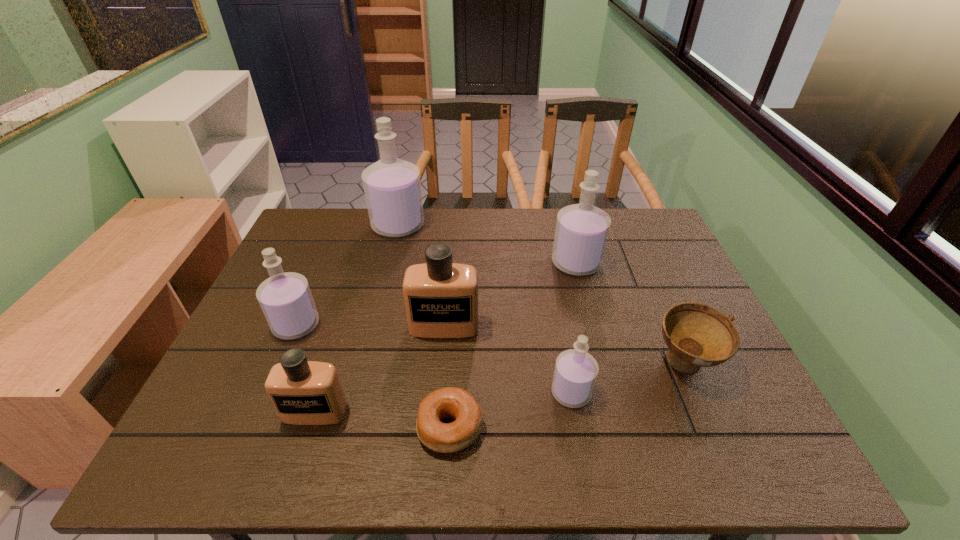
Identify the location of free point between the right beige perfume and the bagel. The height and width of the screenshot is (540, 960). (447, 377).

Where is `empty location between the soup bowl and the leftmost purple perfume`? This screenshot has width=960, height=540. empty location between the soup bowl and the leftmost purple perfume is located at coordinates (490, 345).

The width and height of the screenshot is (960, 540). Find the location of `vacant area that lies between the smallest purple perfume and the third biggest purple perfume`. vacant area that lies between the smallest purple perfume and the third biggest purple perfume is located at coordinates (434, 359).

Find the location of a particular element. The width and height of the screenshot is (960, 540). free space between the rightmost object and the third nearest purple perfume is located at coordinates (630, 314).

The height and width of the screenshot is (540, 960). In order to click on free space between the farther beige perfume and the shortest object in this screenshot , I will do `click(447, 377)`.

The height and width of the screenshot is (540, 960). Identify the location of vacant space that is in between the soup bowl and the second smallest purple perfume. coord(490,345).

Where is `blank region between the nearest purple perfume and the shortest object`? The width and height of the screenshot is (960, 540). blank region between the nearest purple perfume and the shortest object is located at coordinates (511, 410).

The width and height of the screenshot is (960, 540). What are the coordinates of `vacant space that's between the leftmost purple perfume and the right beige perfume` in the screenshot? It's located at (371, 326).

Find the location of `the sixth closest object relative to the leftmost purple perfume`. the sixth closest object relative to the leftmost purple perfume is located at coordinates (581, 233).

You are a GUI agent. You are given a task and a screenshot of the screen. Output one action in this format:
    pyautogui.click(x=<x>, y=<y>)
    Task: Click on the object that ranks as the fourth closest to the tallest perfume
    Image resolution: width=960 pixels, height=540 pixels.
    Given the screenshot: What is the action you would take?
    pyautogui.click(x=303, y=392)